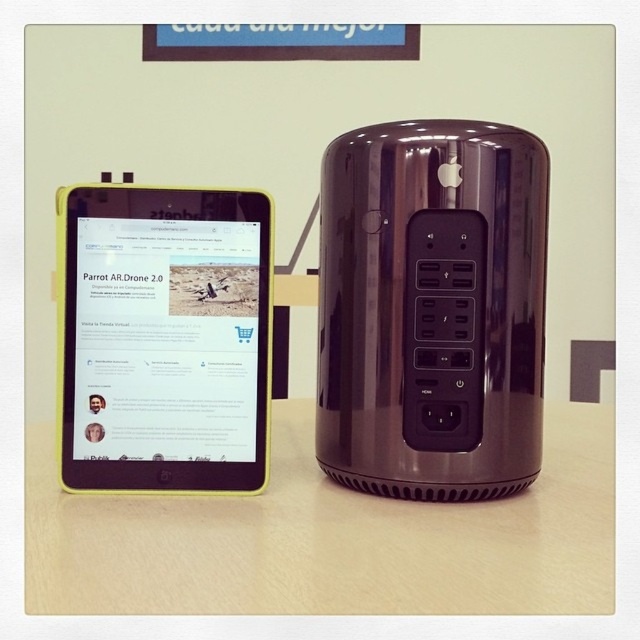
What do you see at coordinates (433, 308) in the screenshot?
I see `satin black ipod at right` at bounding box center [433, 308].

Locate an element on the screen. satin black ipod at right is located at coordinates (433, 308).

This screenshot has height=640, width=640. Find the location of `satin black ipod at right`. satin black ipod at right is located at coordinates (433, 308).

Measure the distance between satin black ipod at right and yellow plastic tablet at left.

satin black ipod at right and yellow plastic tablet at left are 5.25 inches apart from each other.

The image size is (640, 640). What do you see at coordinates (433, 308) in the screenshot?
I see `satin black ipod at right` at bounding box center [433, 308].

This screenshot has height=640, width=640. Find the location of `satin black ipod at right`. satin black ipod at right is located at coordinates (433, 308).

From the picture: Is wooden table at center to the right of yellow plastic tablet at left from the viewer's perspective?

Correct, you'll find wooden table at center to the right of yellow plastic tablet at left.

What do you see at coordinates (330, 538) in the screenshot?
I see `wooden table at center` at bounding box center [330, 538].

Identify the location of wooden table at center. [x=330, y=538].